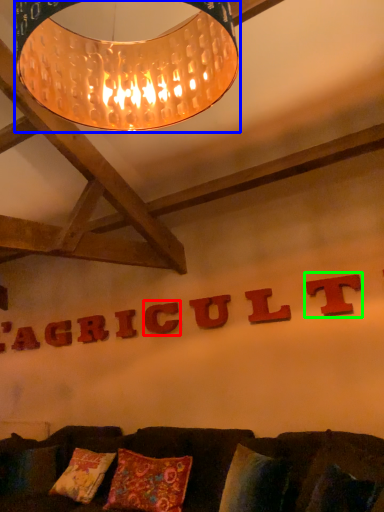
Question: Considering the real-world distances, which object is farthest from letter (highlighted by a red box)? lamp (highlighted by a blue box) or letter (highlighted by a green box)?

Choices:
 (A) lamp
 (B) letter

Answer: (A)